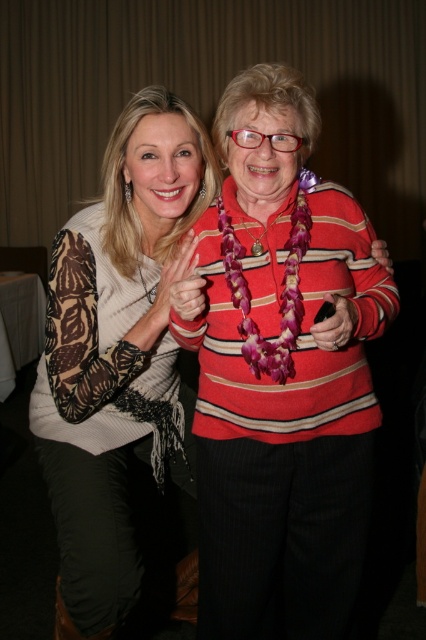
Between matte white sweater at center and matte black phone at center, which one appears on the right side from the viewer's perspective?

Positioned to the right is matte black phone at center.

Can you confirm if matte white sweater at center is thinner than matte black phone at center?

In fact, matte white sweater at center might be wider than matte black phone at center.

Find the location of `matte white sweater at center`. matte white sweater at center is located at coordinates (115, 355).

I want to click on matte white sweater at center, so click(115, 355).

Is striped sweater at center to the left of matte red sweater at center from the viewer's perspective?

Correct, you'll find striped sweater at center to the left of matte red sweater at center.

Does point (271, 410) lie behind point (388, 253)?

No.

You are a GUI agent. You are given a task and a screenshot of the screen. Output one action in this format:
    pyautogui.click(x=<x>, y=<y>)
    Task: Click on the striped sweater at center
    This screenshot has width=426, height=640.
    Given the screenshot: What is the action you would take?
    pyautogui.click(x=279, y=376)

Can you confirm if matte black phone at center is bigger than matte red sweater at center?

No, matte black phone at center is not bigger than matte red sweater at center.

Between point (319, 324) and point (374, 241), which one is positioned behind?

Point (374, 241)

Measure the distance between matte black phone at center and camera.

matte black phone at center and camera are 37.72 inches apart from each other.

The width and height of the screenshot is (426, 640). Find the location of `matte black phone at center`. matte black phone at center is located at coordinates click(336, 324).